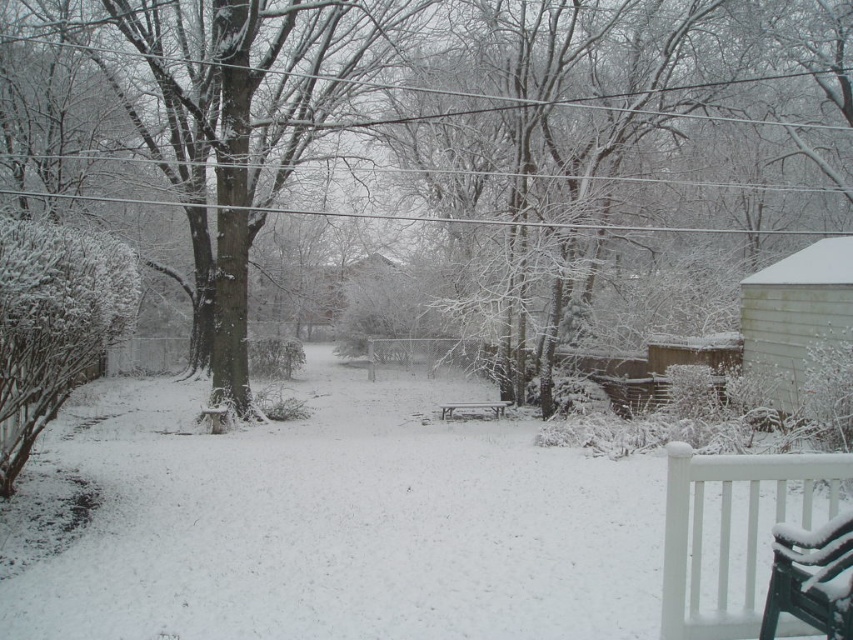
Question: Which of the following is the closest to the observer?

Choices:
 (A) wooden park bench at center
 (B) snow-covered wood bench at lower right
 (C) white fluffy snow at center

Answer: (B)

Question: Is white fluffy snow at center wider than white wooden bench at lower right?

Choices:
 (A) no
 (B) yes

Answer: (B)

Question: Does white wooden bench at lower right appear on the right side of snow-covered wood bench at lower right?

Choices:
 (A) no
 (B) yes

Answer: (B)

Question: Among these objects, which one is nearest to the camera?

Choices:
 (A) white wooden bench at lower right
 (B) snow-covered wood bench at lower right
 (C) wooden park bench at center
 (D) white fluffy snow at center

Answer: (B)

Question: Can you confirm if white wooden bench at lower right is bigger than snow-covered wood bench at lower right?

Choices:
 (A) yes
 (B) no

Answer: (A)

Question: Based on their relative distances, which object is farther from the white fluffy snow at center?

Choices:
 (A) white wooden bench at lower right
 (B) wooden park bench at center
 (C) snow-covered wood bench at lower right

Answer: (B)